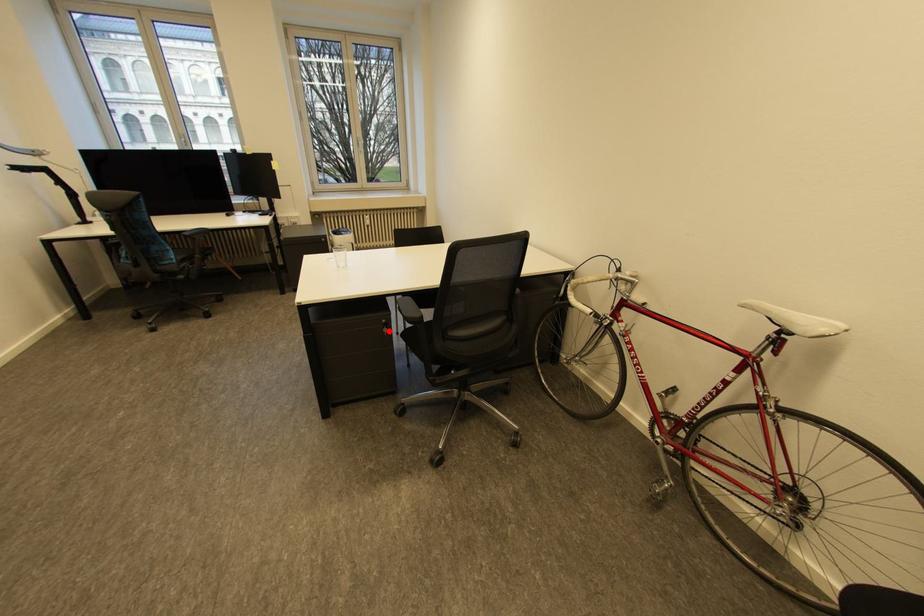
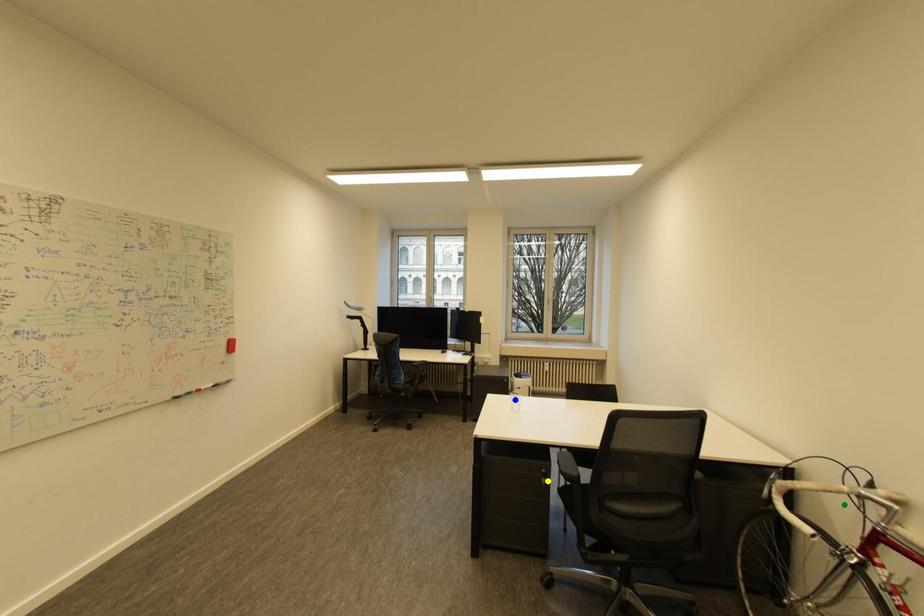
Question: I am providing you with two images of the same scene from different viewpoints. A red point is marked on the first image. You are given multiple points on the second image. Can you choose the point in image 2 that corresponds to the point in image 1?

Choices:
 (A) green point
 (B) yellow point
 (C) blue point

Answer: (B)